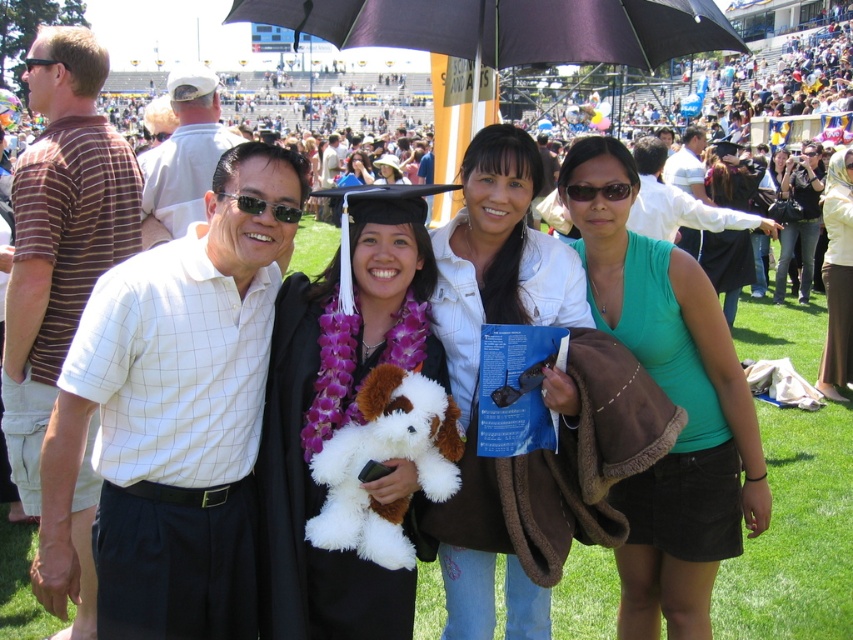
Is matte black graduation gown at center further to the viewer compared to white denim jacket at center?

No, it is not.

Looking at this image, who is more forward, (294, 481) or (494, 244)?

Point (294, 481) is more forward.

Locate an element on the screen. matte black graduation gown at center is located at coordinates (339, 412).

Between matte black graduation gown at center and purple fabric lei at center, which one appears on the right side from the viewer's perspective?

Positioned to the right is matte black graduation gown at center.

Can you confirm if matte black graduation gown at center is wider than purple fabric lei at center?

Yes.

I want to click on matte black graduation gown at center, so click(x=339, y=412).

What are the coordinates of `matte black graduation gown at center` in the screenshot? It's located at (339, 412).

Can you confirm if white denim jacket at center is positioned to the left of purple fabric lei at center?

In fact, white denim jacket at center is to the right of purple fabric lei at center.

Is white denim jacket at center bigger than purple fabric lei at center?

Incorrect, white denim jacket at center is not larger than purple fabric lei at center.

What are the coordinates of `white denim jacket at center` in the screenshot? It's located at (498, 259).